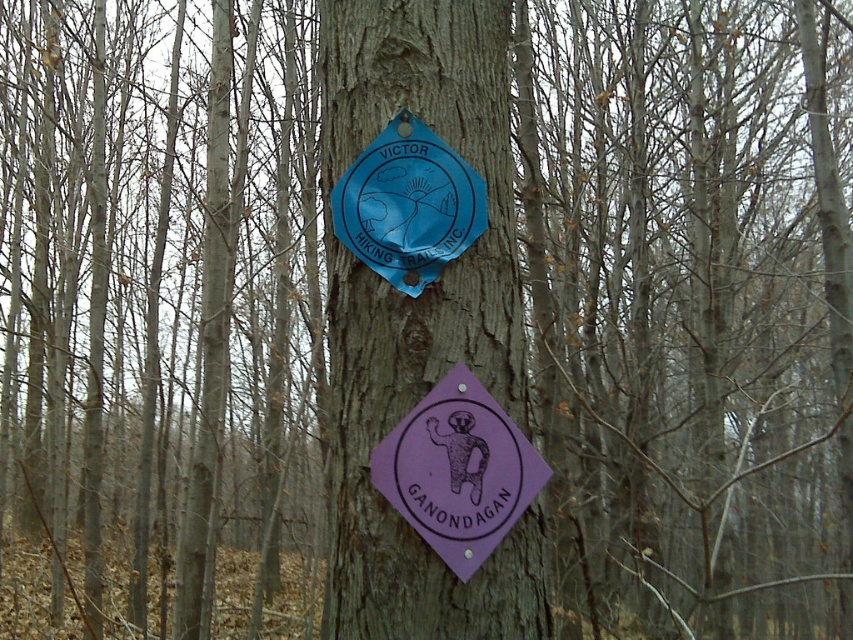
Can you confirm if brown rough tree trunk at center is positioned above blue plastic badge at center?

Actually, brown rough tree trunk at center is below blue plastic badge at center.

Does brown rough tree trunk at center appear under blue plastic badge at center?

Yes, brown rough tree trunk at center is below blue plastic badge at center.

In order to click on brown rough tree trunk at center in this screenshot , I will do `click(421, 317)`.

Who is more forward, (474, 33) or (483, 515)?

Positioned in front is point (483, 515).

Who is more distant from viewer, (428,16) or (434,476)?

The point (428,16) is behind.

You are a GUI agent. You are given a task and a screenshot of the screen. Output one action in this format:
    pyautogui.click(x=<x>, y=<y>)
    Task: Click on the brown rough tree trunk at center
    The height and width of the screenshot is (640, 853).
    Given the screenshot: What is the action you would take?
    pyautogui.click(x=421, y=317)

Identify the location of brown rough tree trunk at center. (421, 317).

Between point (485, 554) and point (426, 202), which one is positioned behind?

The point (426, 202) is behind.

Who is positioned more to the left, purple matte sign at center or blue plastic badge at center?

blue plastic badge at center

Between point (468, 458) and point (412, 253), which one is positioned in front?

Point (468, 458)

You are a GUI agent. You are given a task and a screenshot of the screen. Output one action in this format:
    pyautogui.click(x=<x>, y=<y>)
    Task: Click on the purple matte sign at center
    The width and height of the screenshot is (853, 640).
    Given the screenshot: What is the action you would take?
    (457, 470)